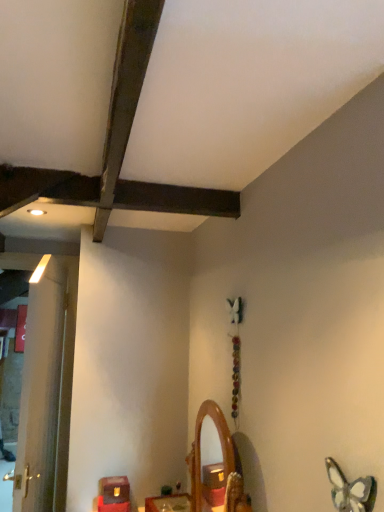
Question: Would you say wooden mirror at center, the second furniture when ordered from left to right, is part of matte brown wooden box at lower left, the 1th furniture from the left,'s contents?

Choices:
 (A) no
 (B) yes

Answer: (A)

Question: Can you confirm if matte brown wooden box at lower left, the second furniture in the right-to-left sequence, is positioned to the right of wooden mirror at center, positioned as the first furniture in right-to-left order?

Choices:
 (A) no
 (B) yes

Answer: (A)

Question: Is matte brown wooden box at lower left, the 1th furniture from the left, oriented away from wooden mirror at center, the second furniture when ordered from left to right?

Choices:
 (A) no
 (B) yes

Answer: (A)

Question: From the image's perspective, is matte brown wooden box at lower left, the 1th furniture from the left, located beneath wooden mirror at center, the second furniture when ordered from left to right?

Choices:
 (A) no
 (B) yes

Answer: (B)

Question: Can you confirm if matte brown wooden box at lower left, the second furniture in the right-to-left sequence, is bigger than wooden mirror at center, the second furniture when ordered from left to right?

Choices:
 (A) no
 (B) yes

Answer: (A)

Question: From the image's perspective, is translucent glass butterfly at lower right above or below wooden mirror at center, positioned as the first furniture in right-to-left order?

Choices:
 (A) below
 (B) above

Answer: (B)

Question: Considering the positions of translucent glass butterfly at lower right and wooden mirror at center, positioned as the first furniture in right-to-left order, in the image, is translucent glass butterfly at lower right taller or shorter than wooden mirror at center, positioned as the first furniture in right-to-left order,?

Choices:
 (A) tall
 (B) short

Answer: (A)

Question: In terms of width, does translucent glass butterfly at lower right look wider or thinner when compared to wooden mirror at center, the second furniture when ordered from left to right?

Choices:
 (A) thin
 (B) wide

Answer: (A)

Question: Would you say translucent glass butterfly at lower right is to the left or to the right of wooden mirror at center, positioned as the first furniture in right-to-left order, in the picture?

Choices:
 (A) right
 (B) left

Answer: (A)

Question: Is wooden mirror at center inside the boundaries of white wood door at left, or outside?

Choices:
 (A) outside
 (B) inside

Answer: (A)

Question: From their relative heights in the image, would you say wooden mirror at center is taller or shorter than white wood door at left?

Choices:
 (A) short
 (B) tall

Answer: (A)

Question: In terms of width, does wooden mirror at center look wider or thinner when compared to white wood door at left?

Choices:
 (A) thin
 (B) wide

Answer: (A)

Question: Is wooden mirror at center to the left or to the right of white wood door at left in the image?

Choices:
 (A) left
 (B) right

Answer: (B)

Question: From a real-world perspective, is wooden mirror at center, positioned as the first furniture in right-to-left order, above or below wooden mirror at center?

Choices:
 (A) below
 (B) above

Answer: (A)

Question: Is wooden mirror at center, positioned as the first furniture in right-to-left order, wider or thinner than wooden mirror at center?

Choices:
 (A) wide
 (B) thin

Answer: (A)